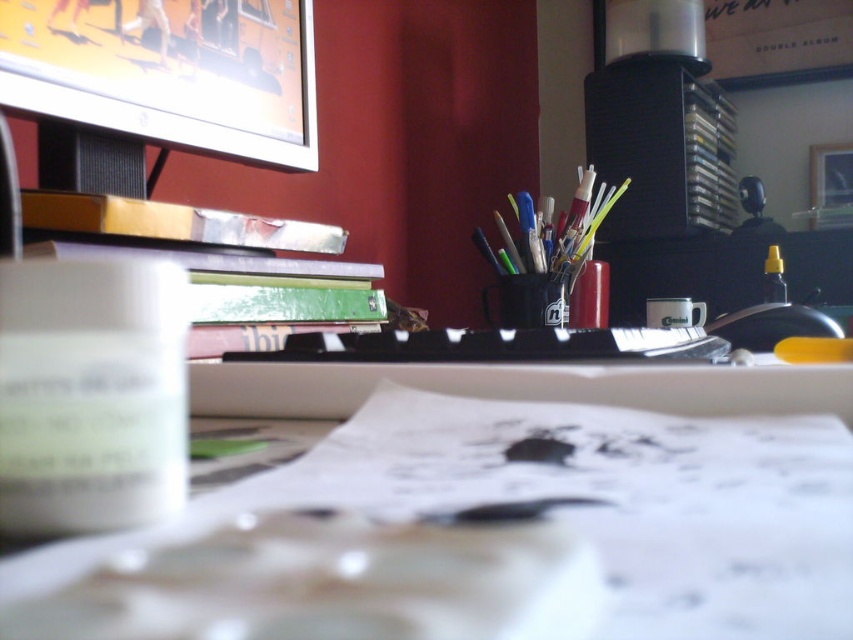
You are organizing your desk and want to place a new item exactly where the white paper at center is currently located. According to the coordinates provided, where should you place the new item?

The white paper at center is located at coordinates point [480,532], so you should place the new item at that exact position.

Consider the image. You are organizing your desk and need to place a new item between the white paper at center and the metallic silver stapler at center. What is the minimum distance you need to maintain between them to ensure the new item fits?

The white paper at center and metallic silver stapler at center are 3.76 feet apart, so the minimum distance you need to maintain between them is 3.76 feet to ensure the new item fits.

Where is the matte silver monitor at upper left located in the image?

The matte silver monitor at upper left is located at point coordinates of 0.113 on the x axis and 0.199 on the y axis.